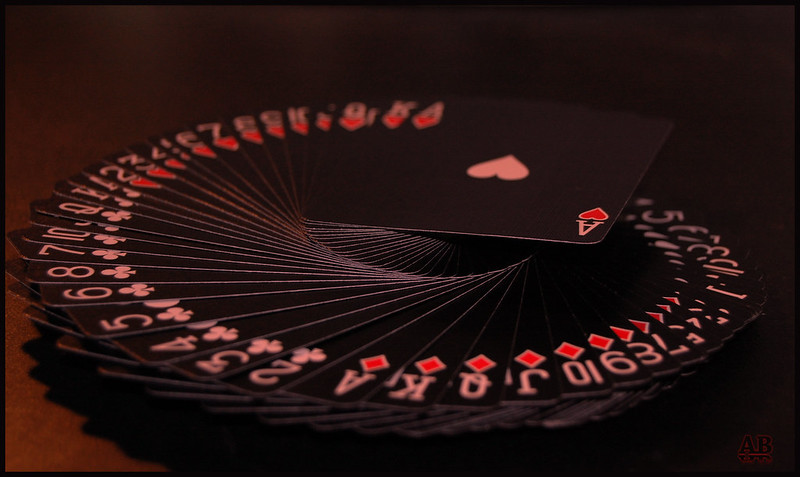
Identify the location of deck of playing cards. (421, 266).